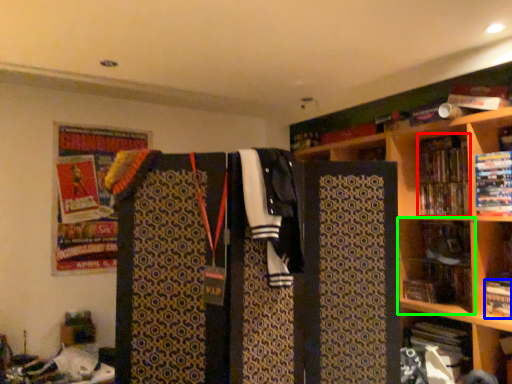
Question: Which is nearer to the book (highlighted by a red box)? book (highlighted by a blue box) or shelf (highlighted by a green box).

Choices:
 (A) book
 (B) shelf

Answer: (B)